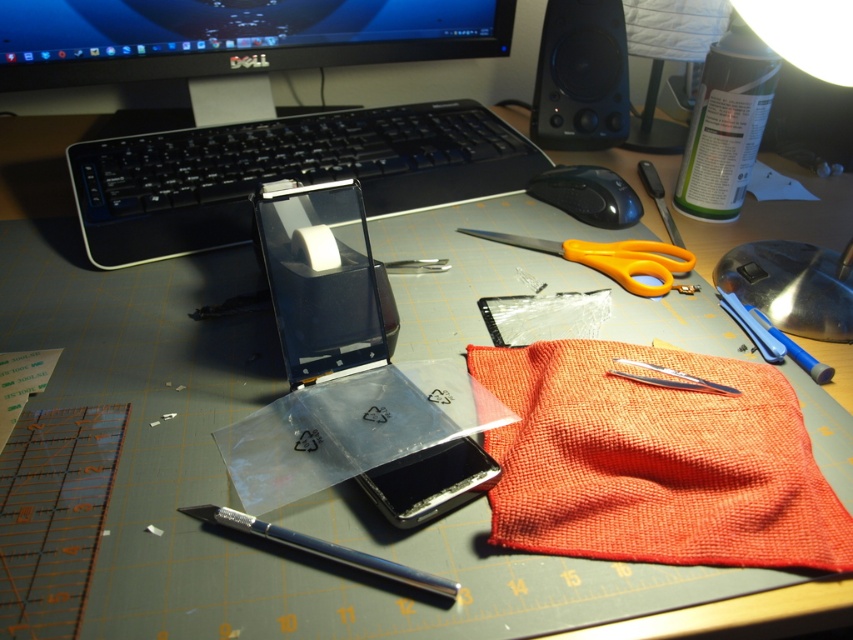
Question: Is transparent plastic laptop at center wider than black plastic mouse at center?

Choices:
 (A) no
 (B) yes

Answer: (B)

Question: Which object is positioned farthest from the metallic silver pen at lower center?

Choices:
 (A) transparent plastic laptop at center
 (B) orange plastic scissors at center
 (C) orange fabric at lower right

Answer: (B)

Question: Which of these objects is positioned closest to the black plastic mouse at center?

Choices:
 (A) black glossy monitor at upper center
 (B) black plastic speaker at upper right

Answer: (B)

Question: Does black plastic keyboard at center come in front of black plastic speaker at upper right?

Choices:
 (A) no
 (B) yes

Answer: (B)

Question: Which object appears closest to the camera in this image?

Choices:
 (A) black plastic speaker at upper right
 (B) orange fabric at lower right
 (C) black plastic mouse at center

Answer: (B)

Question: Does black plastic keyboard at center appear under metallic silver pen at lower center?

Choices:
 (A) no
 (B) yes

Answer: (A)